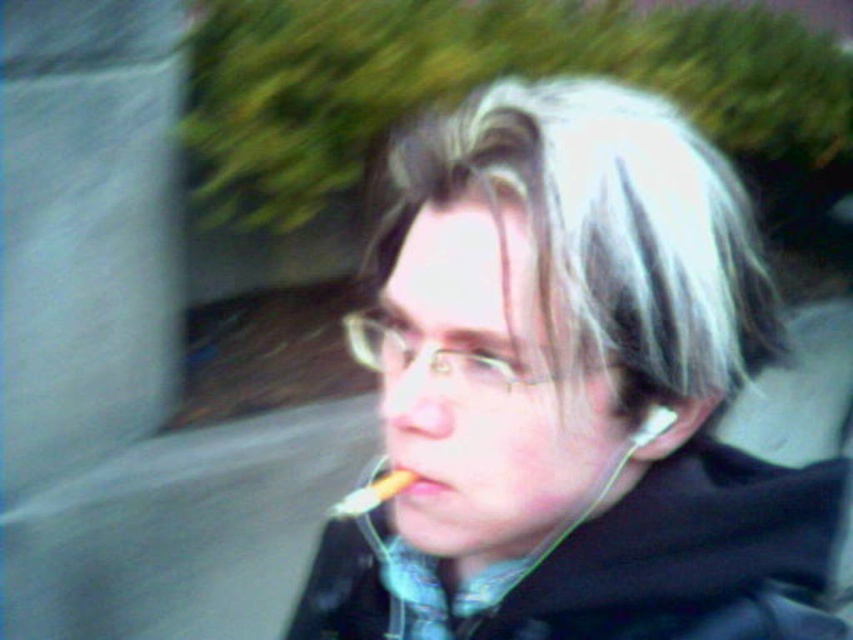
From the picture: Can you confirm if matte black jacket at center is thinner than smooth yellow toothbrush at lower center?

→ In fact, matte black jacket at center might be wider than smooth yellow toothbrush at lower center.

Who is lower down, matte black jacket at center or smooth yellow toothbrush at lower center?

Positioned lower is matte black jacket at center.

Find the location of `matte black jacket at center`. matte black jacket at center is located at coordinates (569, 390).

Who is lower down, matte black jacket at center or yellowish matte cigarette at center?

yellowish matte cigarette at center is lower down.

Can you confirm if matte black jacket at center is smaller than yellowish matte cigarette at center?

No, matte black jacket at center is not smaller than yellowish matte cigarette at center.

This screenshot has width=853, height=640. In order to click on matte black jacket at center in this screenshot , I will do `click(569, 390)`.

Who is positioned more to the left, black matte jacket at lower right or smooth yellow toothbrush at lower center?

smooth yellow toothbrush at lower center is more to the left.

Does black matte jacket at lower right appear over smooth yellow toothbrush at lower center?

No.

Who is more forward, (374,611) or (381,481)?

Point (381,481)

This screenshot has height=640, width=853. Find the location of `black matte jacket at lower right`. black matte jacket at lower right is located at coordinates (x=689, y=557).